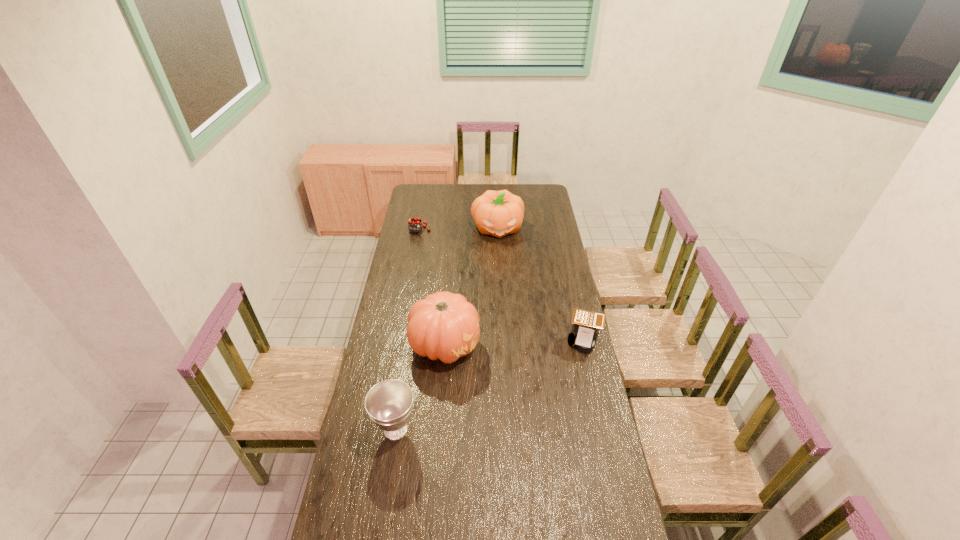
At what (x,y) coordinates should I click in order to perform the action: click on vacant area that lies between the calculator and the farther pumpkin. Please return your answer as a coordinate pair (x, y). The image size is (960, 540). Looking at the image, I should click on (541, 284).

The image size is (960, 540). I want to click on free space between the farther pumpkin and the nearer pumpkin, so click(x=471, y=286).

Locate an element on the screen. free point between the rightmost object and the pot filled with cherries is located at coordinates (502, 285).

In order to click on blank region between the farther pumpkin and the pot filled with cherries in this screenshot , I will do `click(459, 229)`.

The height and width of the screenshot is (540, 960). I want to click on the second closest object relative to the nearer pumpkin, so click(x=586, y=324).

Locate an element on the screen. This screenshot has height=540, width=960. the closest object to the nearer pumpkin is located at coordinates (389, 403).

Identify the location of vacant region that satisfies the following two spatial constraints: 1. on the front side of the nearer pumpkin; 2. on the left side of the pot filled with cherries. The height and width of the screenshot is (540, 960). (399, 345).